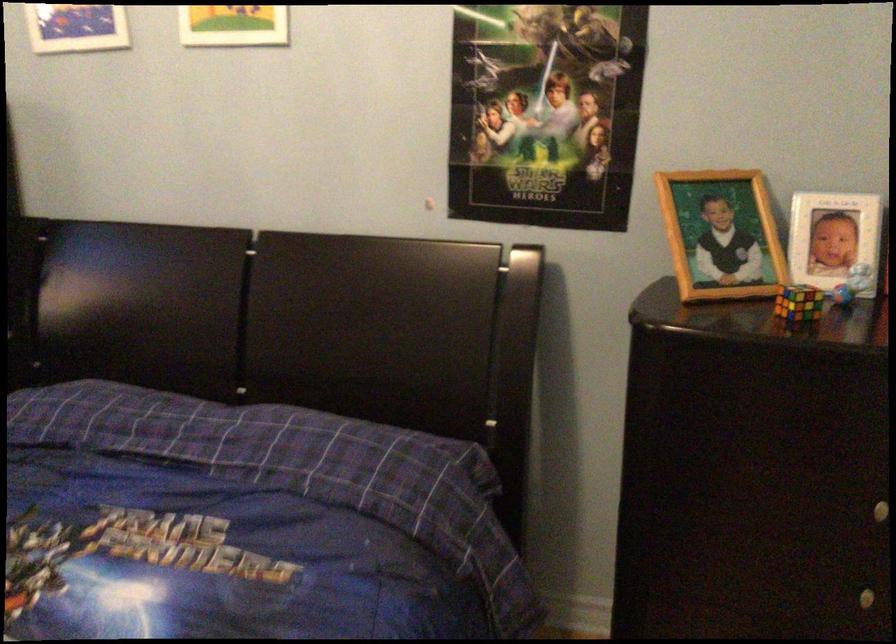
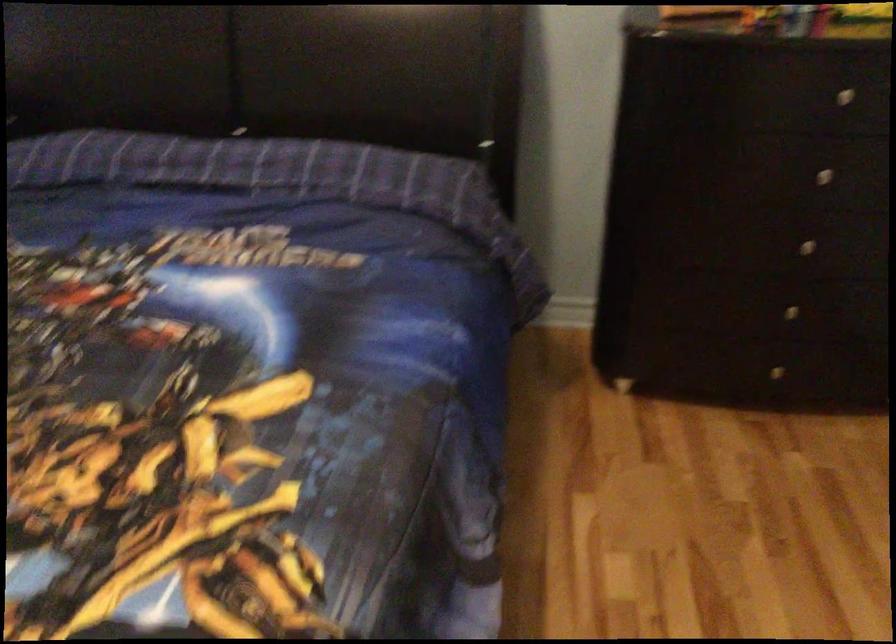
Question: How did the camera likely rotate?

Choices:
 (A) Left
 (B) Right
 (C) Up
 (D) Down

Answer: (D)